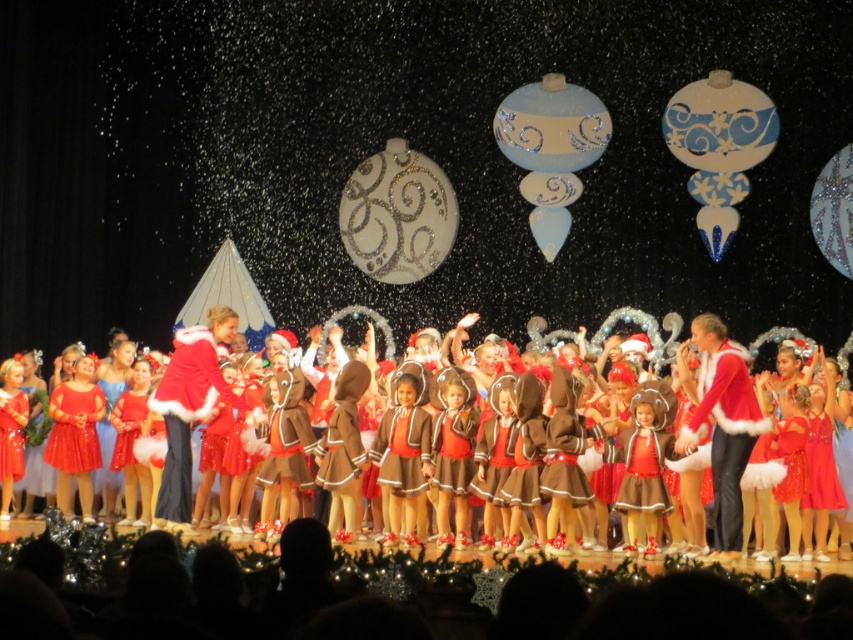
Question: Which object appears closest to the camera in this image?

Choices:
 (A) shiny red dresses at center
 (B) shiny red dress at center

Answer: (A)

Question: Which point appears farthest from the camera in this image?

Choices:
 (A) (6, 408)
 (B) (59, 426)
 (C) (781, 461)

Answer: (B)

Question: Does matte red dress at left appear on the right side of shiny red dress at center?

Choices:
 (A) no
 (B) yes

Answer: (B)

Question: Is shiny red dresses at center bigger than shiny red dress at center?

Choices:
 (A) yes
 (B) no

Answer: (A)

Question: Can you confirm if shiny red dresses at center is positioned below matte red dress at left?

Choices:
 (A) no
 (B) yes

Answer: (A)

Question: Considering the real-world distances, which object is closest to the shiny red dresses at center?

Choices:
 (A) matte red dress at left
 (B) shiny red dress at center

Answer: (A)